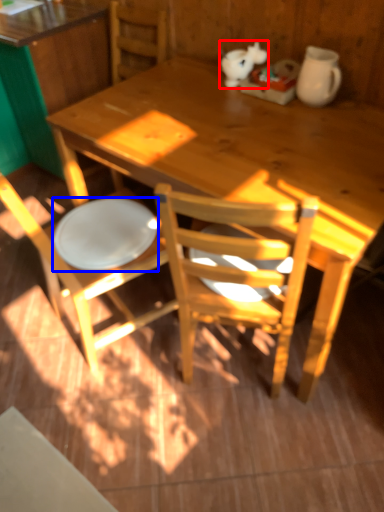
Question: Which object appears closest to the camera in this image, animal (highlighted by a red box) or plate (highlighted by a blue box)?

Choices:
 (A) animal
 (B) plate

Answer: (B)